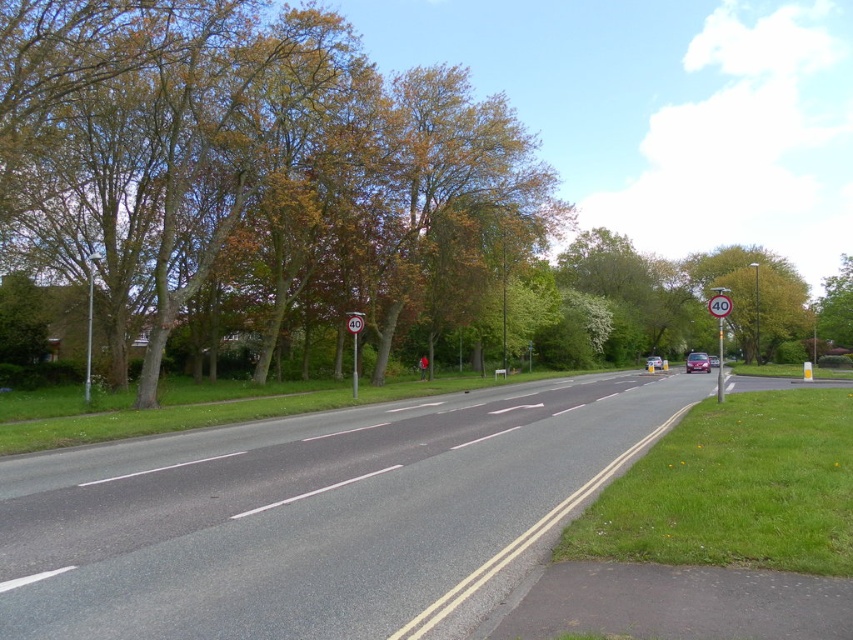
Question: Which point is farther to the camera?

Choices:
 (A) metallic red car at center
 (B) metallic circular sign at center
 (C) metallic reflective speed limit sign at right
 (D) white plastic speed limit sign at center

Answer: (A)

Question: Does brown leafy tree at upper left appear on the right side of white plastic speed limit sign at center?

Choices:
 (A) no
 (B) yes

Answer: (B)

Question: Which point is closer to the camera taking this photo?

Choices:
 (A) (352, 333)
 (B) (350, 332)

Answer: (B)

Question: Is white plastic speed limit sign at center wider than metallic circular sign at center?

Choices:
 (A) yes
 (B) no

Answer: (A)

Question: Among these points, which one is farthest from the camera?

Choices:
 (A) (662, 362)
 (B) (357, 324)
 (C) (720, 381)
 (D) (357, 342)

Answer: (A)

Question: Is white plastic speed limit sign at center bigger than metallic silver car at center?

Choices:
 (A) no
 (B) yes

Answer: (A)